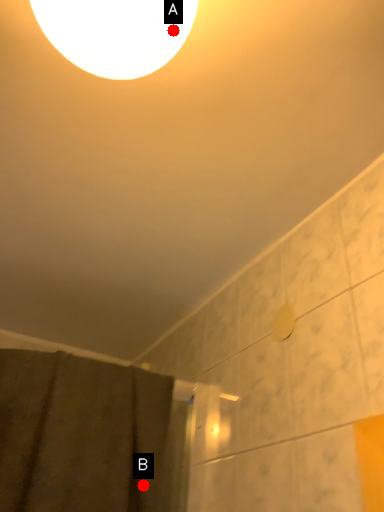
Question: Two points are circled on the image, labeled by A and B beside each circle. Which of the following is the farthest from the observer?

Choices:
 (A) A is further
 (B) B is further

Answer: (B)